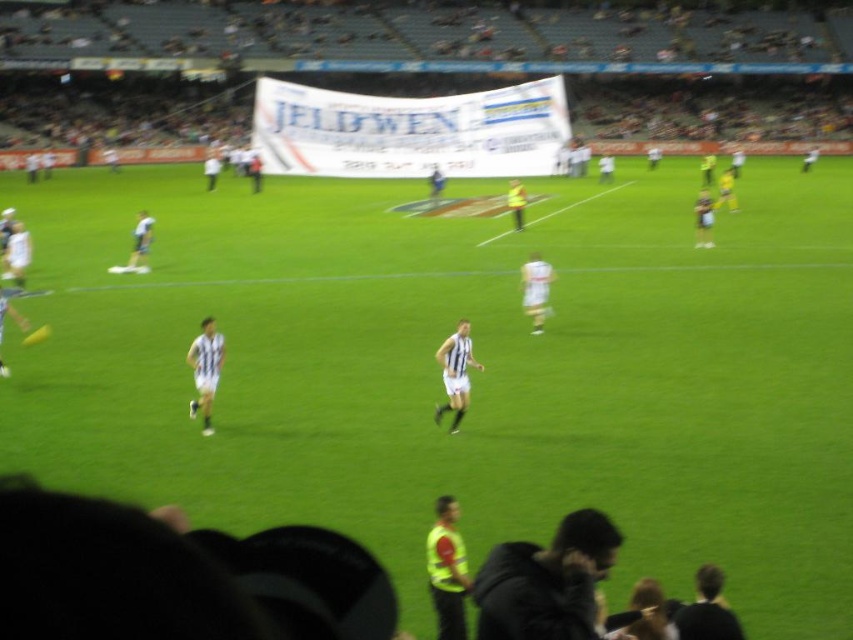
Question: Which object is closer to the camera taking this photo?

Choices:
 (A) yellow reflective vest at center
 (B) white striped jersey at center
 (C) yellow reflective vest at lower center

Answer: (C)

Question: Does yellow reflective vest at lower center appear on the left side of yellow reflective vest at center?

Choices:
 (A) no
 (B) yes

Answer: (A)

Question: Can you confirm if yellow reflective vest at lower center is bigger than yellow reflective vest at center?

Choices:
 (A) yes
 (B) no

Answer: (A)

Question: Can you confirm if yellow reflective vest at lower center is positioned below yellow reflective vest at center?

Choices:
 (A) no
 (B) yes

Answer: (A)

Question: Which object is farther from the camera taking this photo?

Choices:
 (A) yellow reflective vest at lower center
 (B) white striped jersey at center

Answer: (B)

Question: Which point is closer to the camera taking this photo?

Choices:
 (A) (204, 324)
 (B) (582, 632)
 (C) (431, 580)

Answer: (B)